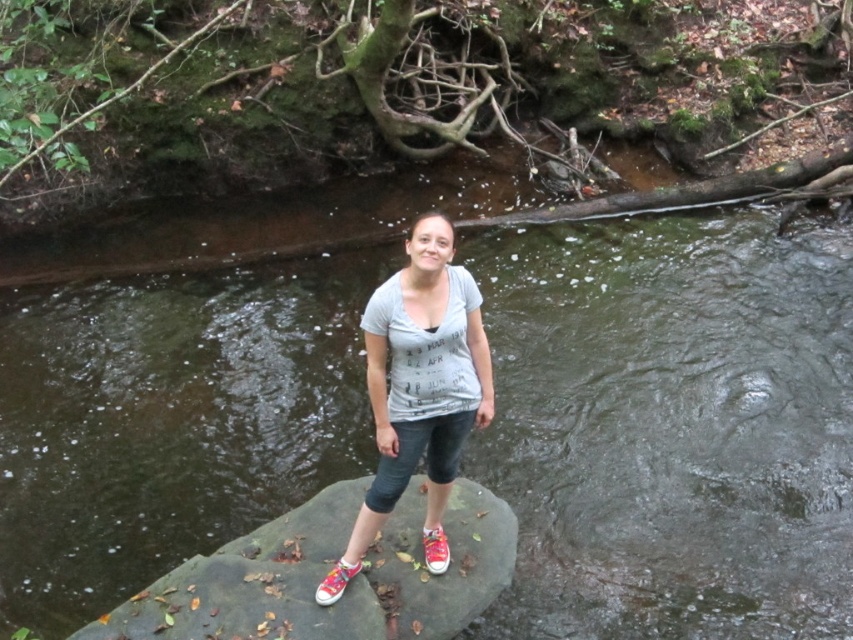
Is matte gray t-shirt at center below shiny pink canvas shoe at center?

Incorrect, matte gray t-shirt at center is not positioned below shiny pink canvas shoe at center.

What do you see at coordinates (422, 376) in the screenshot?
I see `matte gray t-shirt at center` at bounding box center [422, 376].

Does point (404, 289) lie behind point (331, 580)?

No, (404, 289) is in front of (331, 580).

Where is `matte gray t-shirt at center`? The height and width of the screenshot is (640, 853). matte gray t-shirt at center is located at coordinates (422, 376).

Can you confirm if matte gray t-shirt at center is positioned below shiny red canvas shoe at center?

Incorrect, matte gray t-shirt at center is not positioned below shiny red canvas shoe at center.

Can you confirm if matte gray t-shirt at center is shorter than shiny red canvas shoe at center?

No.

Is point (369, 500) in front of point (440, 531)?

Yes, point (369, 500) is in front of point (440, 531).

Image resolution: width=853 pixels, height=640 pixels. Identify the location of matte gray t-shirt at center. (422, 376).

Can you confirm if shiny pink canvas shoe at center is positioned below shiny red canvas shoe at center?

Yes, shiny pink canvas shoe at center is below shiny red canvas shoe at center.

Can you confirm if shiny pink canvas shoe at center is positioned above shiny red canvas shoe at center?

No.

Where is `shiny pink canvas shoe at center`? shiny pink canvas shoe at center is located at coordinates (335, 580).